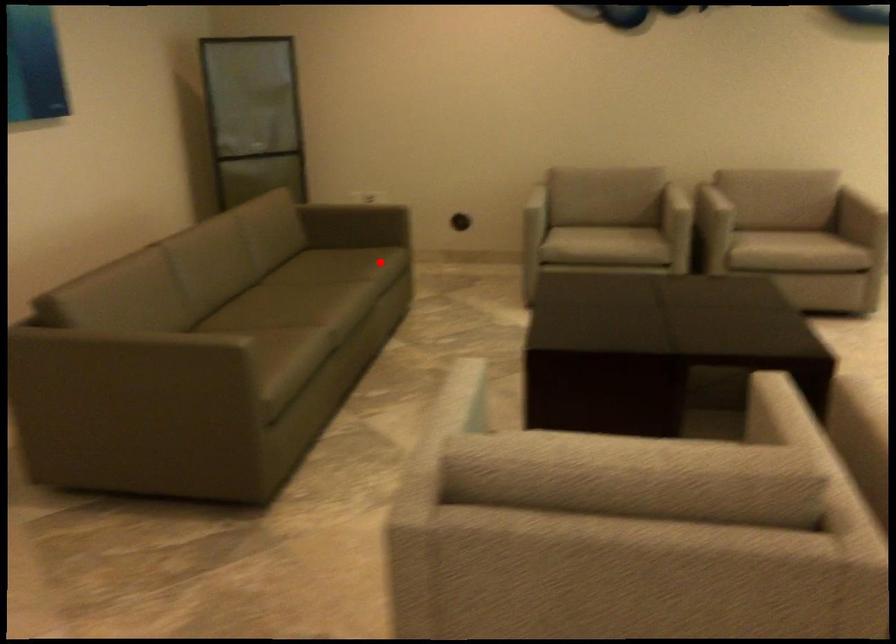
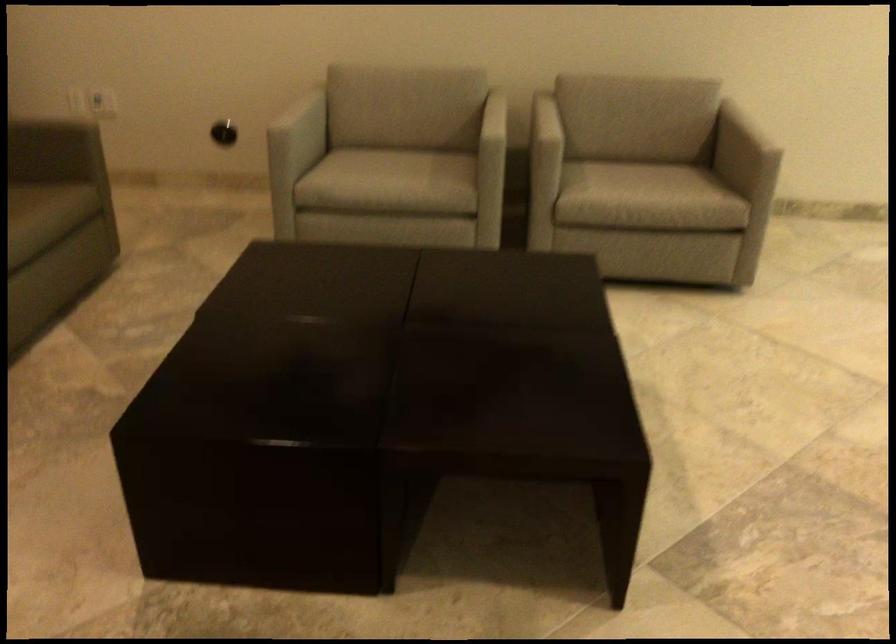
Locate, in the second image, the point that corresponds to the highlighted location in the first image.

(36, 219)